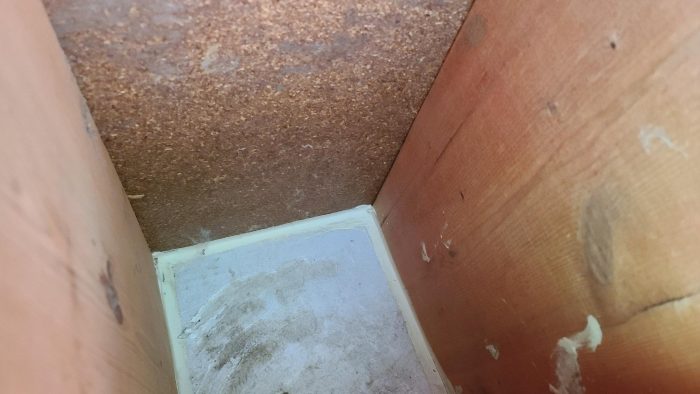
This screenshot has width=700, height=394. In order to click on light gray knot in wood in this screenshot , I will do `click(598, 235)`.